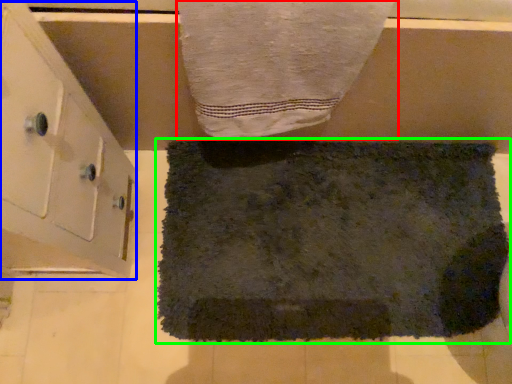
Question: Which is farther away from towel (highlighted by a red box)? cabinetry (highlighted by a blue box) or towel (highlighted by a green box)?

Choices:
 (A) cabinetry
 (B) towel

Answer: (B)